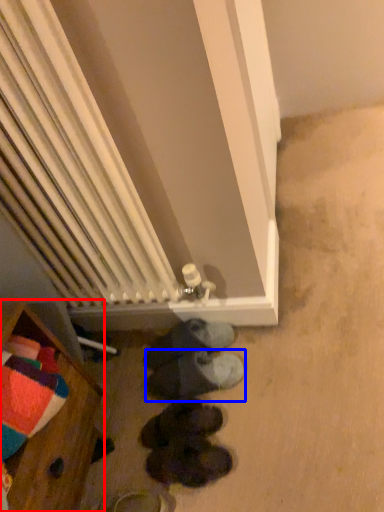
Question: Which object is further to the camera taking this photo, furniture (highlighted by a red box) or footwear (highlighted by a blue box)?

Choices:
 (A) furniture
 (B) footwear

Answer: (B)